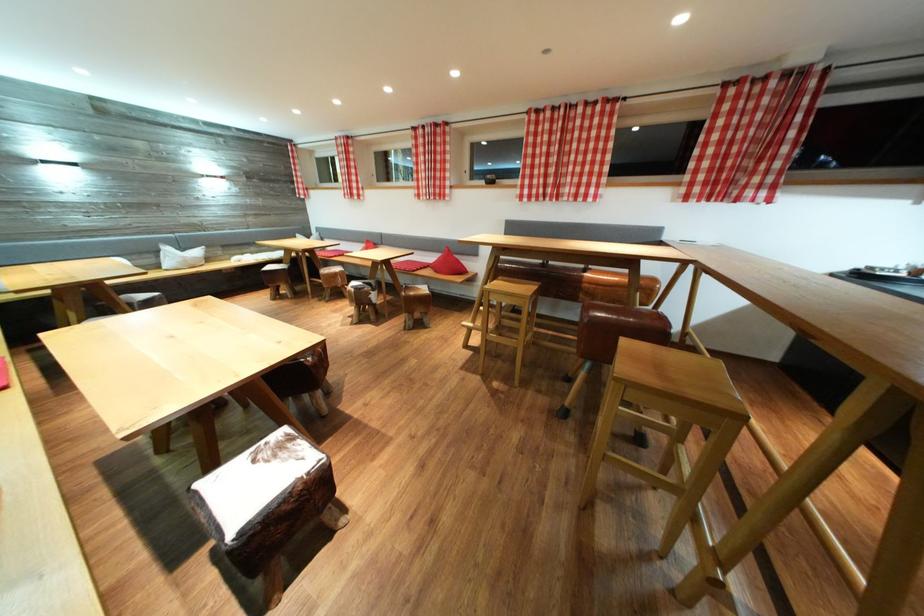
Which object does [447,265] point to?

It refers to a red triangular pillow.